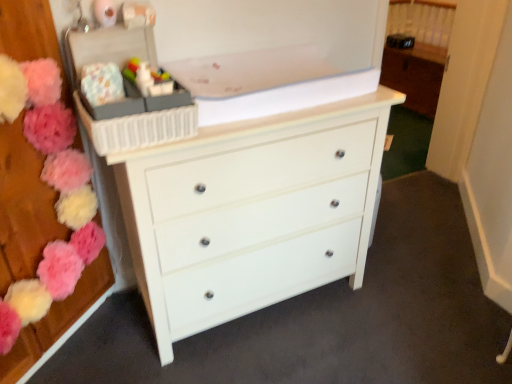
Locate an element on the screen. free space to the right of white glossy chest of drawers at center is located at coordinates (408, 307).